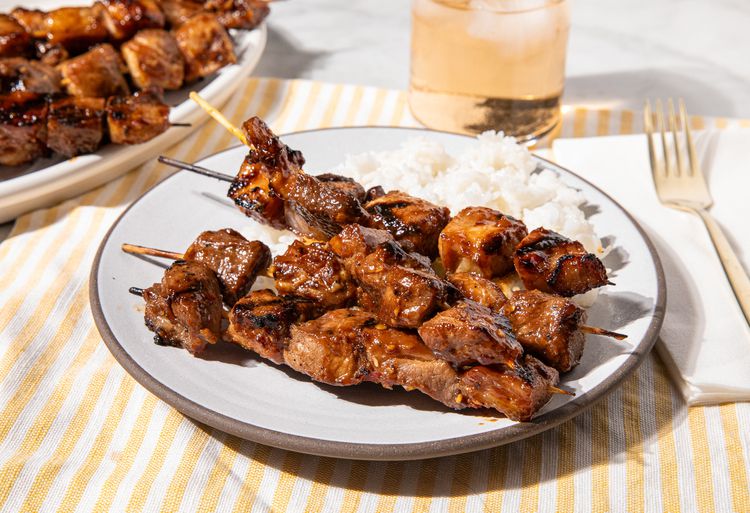
You are a GUI agent. You are given a task and a screenshot of the screen. Output one action in this format:
    pyautogui.click(x=<x>, y=<y>)
    Task: Click on the glass of drink
    This screenshot has width=750, height=513.
    Given the screenshot: What is the action you would take?
    point(483,55)